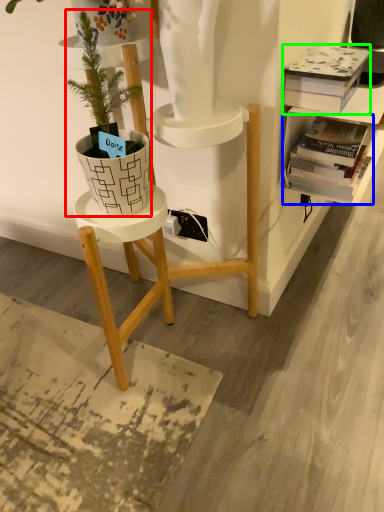
Question: Which is farther away from houseplant (highlighted by a red box)? book (highlighted by a blue box) or book (highlighted by a green box)?

Choices:
 (A) book
 (B) book

Answer: (A)